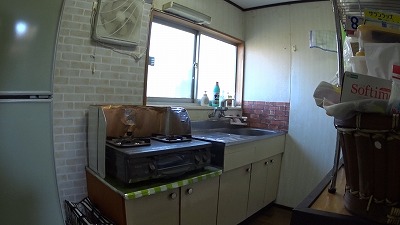
The image size is (400, 225). In order to click on silver knob on cabinet door in this screenshot , I will do `click(190, 191)`.